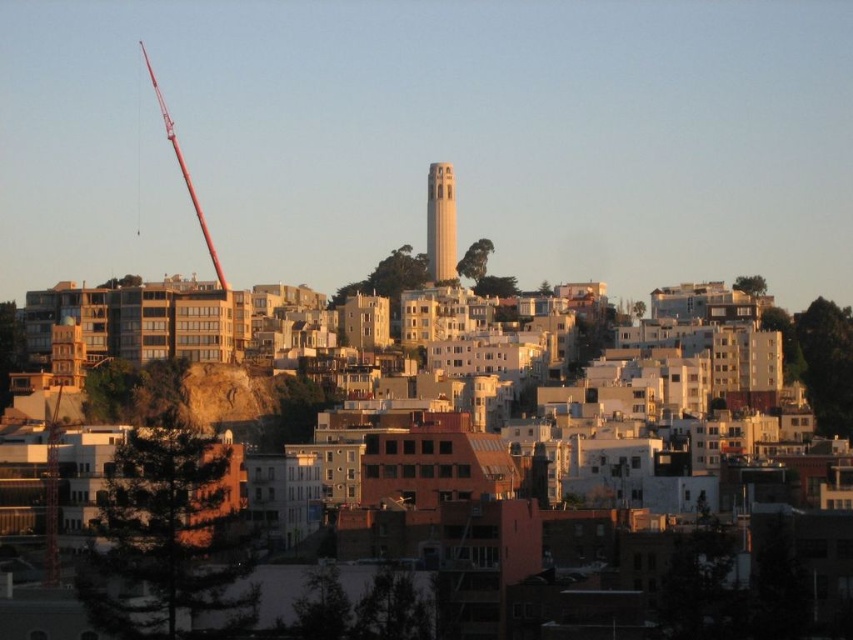
You are a city planner evaluating the urban layout. Given the white concrete tower at center and the metallic red crane at left, which structure occupies a larger physical space in the scene?

The metallic red crane at left is larger than the white concrete tower at center, so it occupies a larger physical space in the scene.

You are a city planner assessing the urban layout. You need to determine if the white concrete tower at center can be seen from the base of the metallic red crane at left. Based on their heights, can you confirm visibility?

The white concrete tower at center is not as tall as the metallic red crane at left, so it might be partially or fully obstructed by the crane when viewed from its base.

You are standing at the camera position observing the urban scene. There is a point marked at coordinates point (426, 230). Can you determine if this point is within a safe distance for a drone to land there? The drone requires a minimum of 1500 feet of clearance from the camera position for safe landing.

The point (426, 230) is 1531.63 feet away from the camera, which exceeds the minimum required clearance of 1500 feet. Therefore, the drone can land safely at this point.